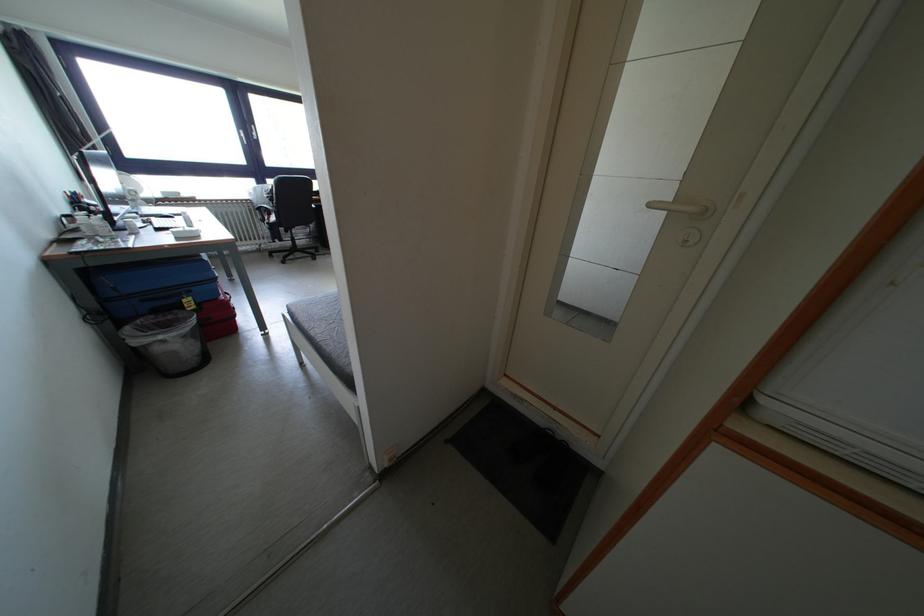
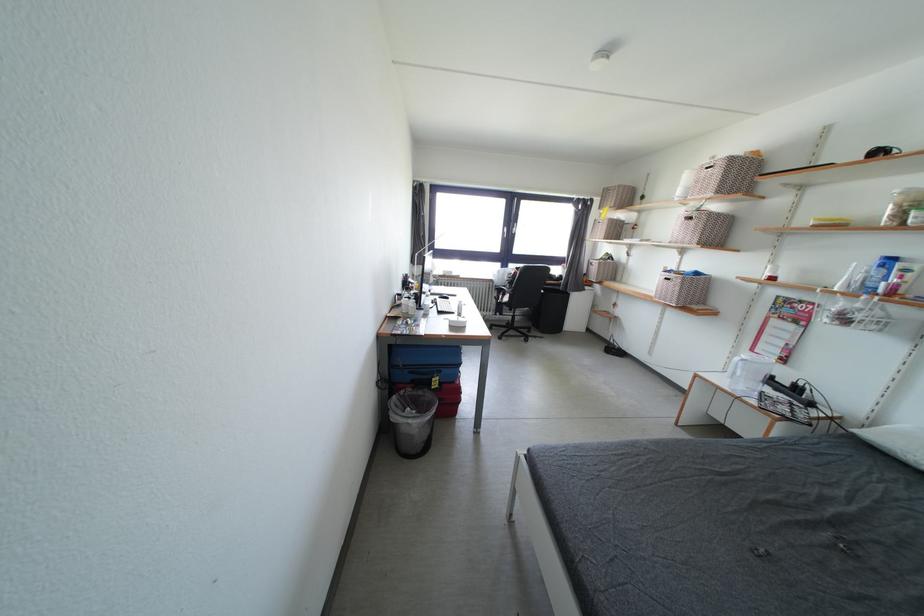
Where in the second image is the point corresponding to the point at 197,296 from the first image?

(446, 377)